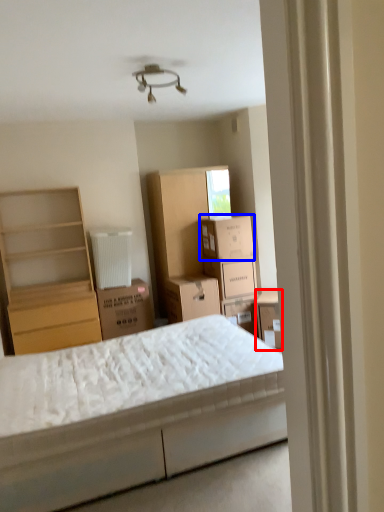
Question: Which of the following is the closest to the observer, storage box (highlighted by a red box) or cardboard box (highlighted by a blue box)?

Choices:
 (A) storage box
 (B) cardboard box

Answer: (A)